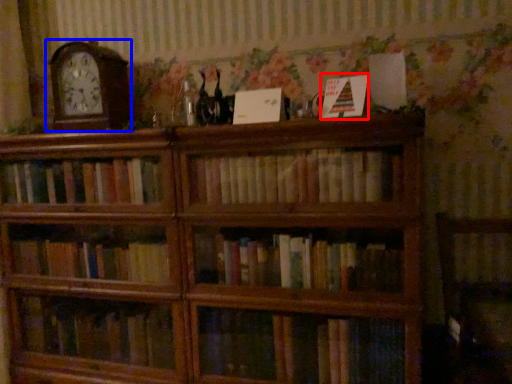
Question: Which point is closer to the camera, paperback book (highlighted by a red box) or clock (highlighted by a blue box)?

Choices:
 (A) paperback book
 (B) clock

Answer: (A)